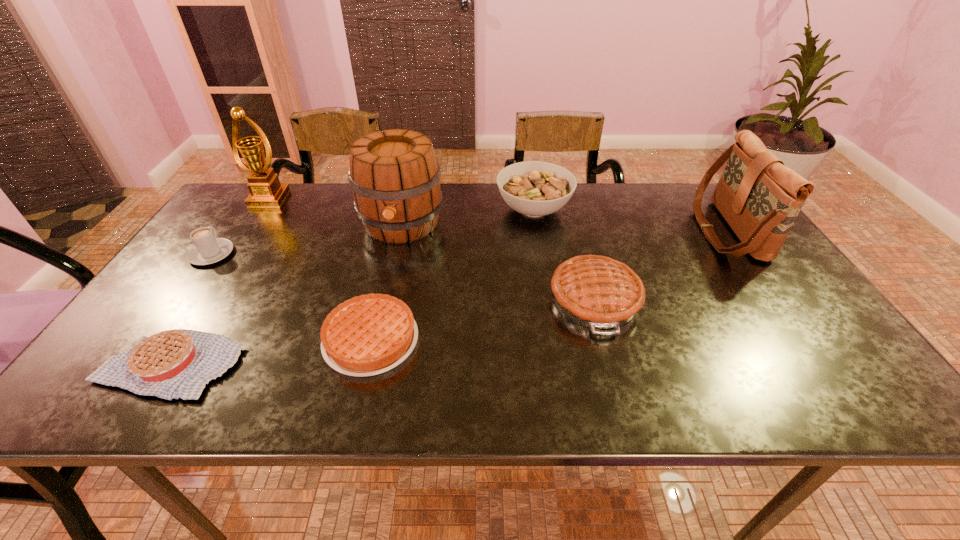
The width and height of the screenshot is (960, 540). Identify the location of free spot that satisfies the following two spatial constraints: 1. to the right of the stew; 2. on the left side of the third shortest object. (244, 210).

In order to click on free point that satisfies the following two spatial constraints: 1. on the front-facing side of the tallest object; 2. on the right side of the fourth shortest object in this screenshot , I will do `click(203, 300)`.

This screenshot has width=960, height=540. Find the location of `vacant space that satisfies the following two spatial constraints: 1. on the front-facing side of the tallest object; 2. on the left side of the second pie from left to right`. vacant space that satisfies the following two spatial constraints: 1. on the front-facing side of the tallest object; 2. on the left side of the second pie from left to right is located at coordinates (176, 340).